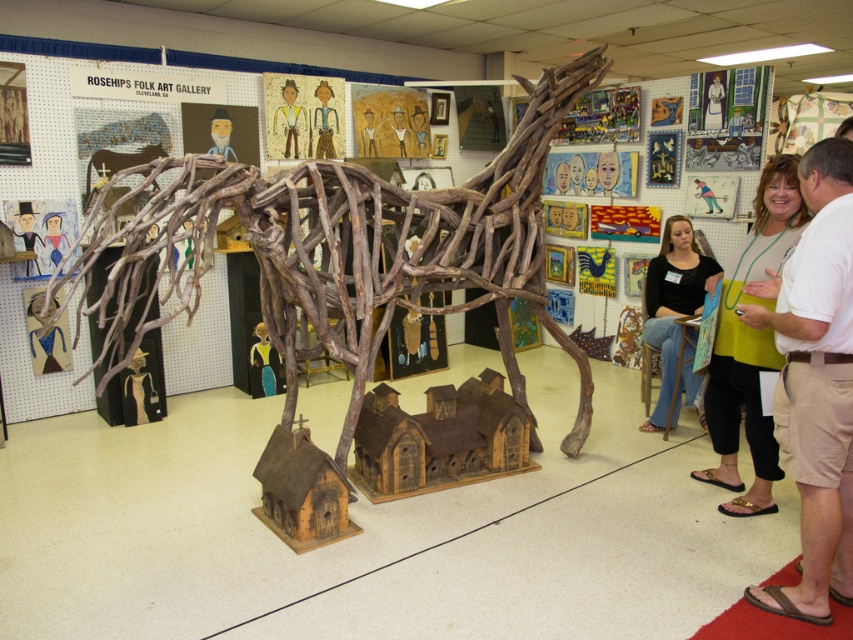
Question: Does brown driftwood horse at center have a larger size compared to matte black shirt at center?

Choices:
 (A) no
 (B) yes

Answer: (B)

Question: Is brown cargo shorts at right to the right of green fabric dress at right from the viewer's perspective?

Choices:
 (A) no
 (B) yes

Answer: (A)

Question: Is the position of brown cargo shorts at right less distant than that of green fabric dress at right?

Choices:
 (A) no
 (B) yes

Answer: (B)

Question: Which of the following is the farthest from the observer?

Choices:
 (A) brown driftwood horse at center
 (B) matte black shirt at center
 (C) green fabric dress at right

Answer: (B)

Question: Which point appears farthest from the camera in this image?

Choices:
 (A) (780, 173)
 (B) (527, 138)
 (C) (674, 353)
 (D) (827, 278)

Answer: (C)

Question: Which object appears farthest from the camera in this image?

Choices:
 (A) matte black shirt at center
 (B) brown driftwood horse at center
 (C) green fabric dress at right
 (D) brown cargo shorts at right

Answer: (A)